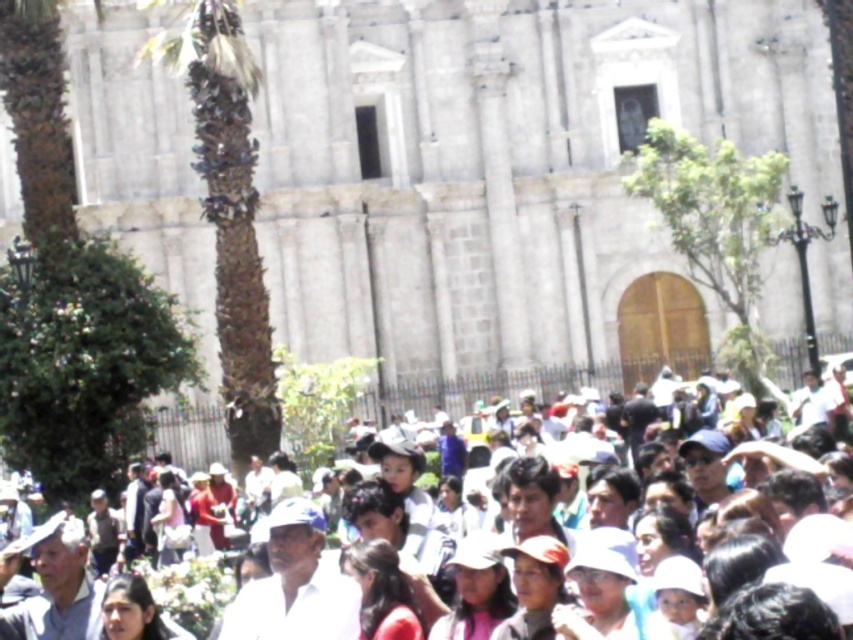
Does green leafy palm tree at left appear over white clothed crowd at center?

Correct, green leafy palm tree at left is located above white clothed crowd at center.

Can you confirm if green leafy palm tree at left is thinner than white clothed crowd at center?

Correct, green leafy palm tree at left's width is less than white clothed crowd at center's.

Which is in front, point (229, 156) or point (469, 403)?

Point (229, 156) is more forward.

Find the location of a particular element. This screenshot has width=853, height=640. green leafy palm tree at left is located at coordinates tap(229, 212).